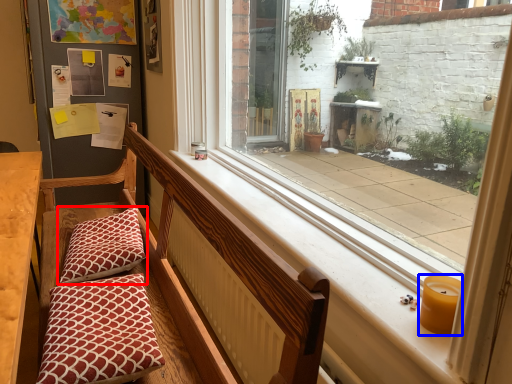
Question: Which object appears closest to the camera in this image, pillow (highlighted by a red box) or candle holder (highlighted by a blue box)?

Choices:
 (A) pillow
 (B) candle holder

Answer: (B)